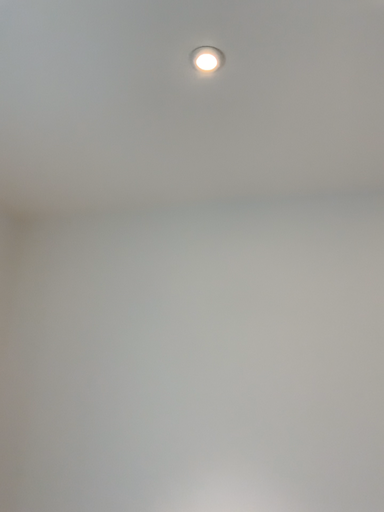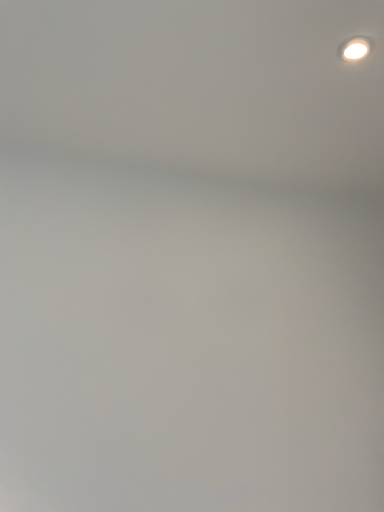
Question: Which way did the camera rotate in the video?

Choices:
 (A) rotated downward
 (B) rotated upward

Answer: (A)